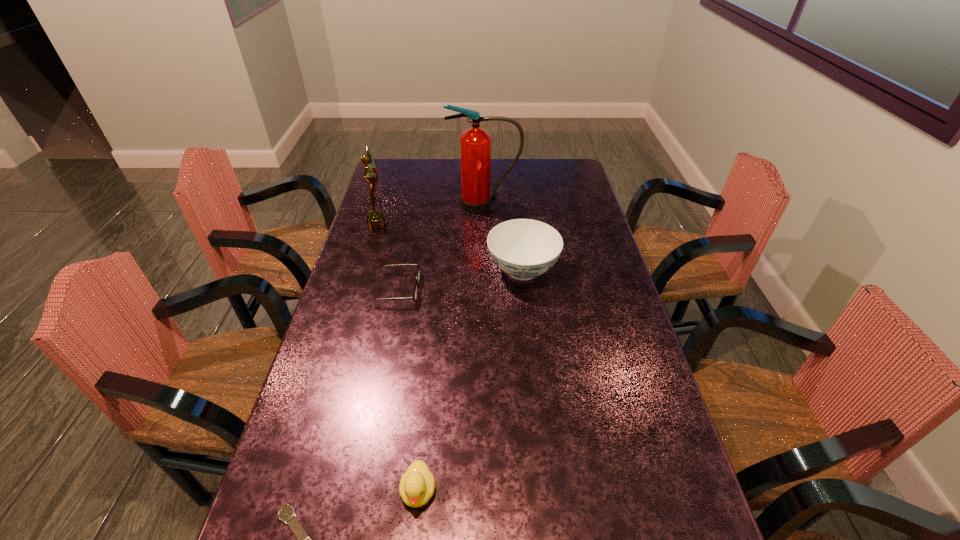
Find the location of a particular element. free space located 0.200m on the front of the fourth shortest object is located at coordinates (531, 345).

Image resolution: width=960 pixels, height=540 pixels. I want to click on vacant point located on the front-facing side of the third object from left to right, so click(x=531, y=289).

Where is `award that is at the left edge`? award that is at the left edge is located at coordinates (375, 220).

I want to click on spectacles that is at the left edge, so click(414, 297).

In order to click on vacant area at the far edge of the desktop in this screenshot , I will do `click(420, 170)`.

This screenshot has width=960, height=540. In the image, there is a desktop. In order to click on vacant space at the left edge in this screenshot , I will do tap(346, 460).

This screenshot has height=540, width=960. Identify the location of blank space at the right edge of the desktop. (692, 507).

Locate an element on the screen. The height and width of the screenshot is (540, 960). vacant space at the far right corner of the desktop is located at coordinates (545, 161).

In order to click on free spot between the spectacles and the duckling in this screenshot , I will do `click(409, 390)`.

Locate an element on the screen. The height and width of the screenshot is (540, 960). free point between the tallest object and the fourth tallest object is located at coordinates (451, 348).